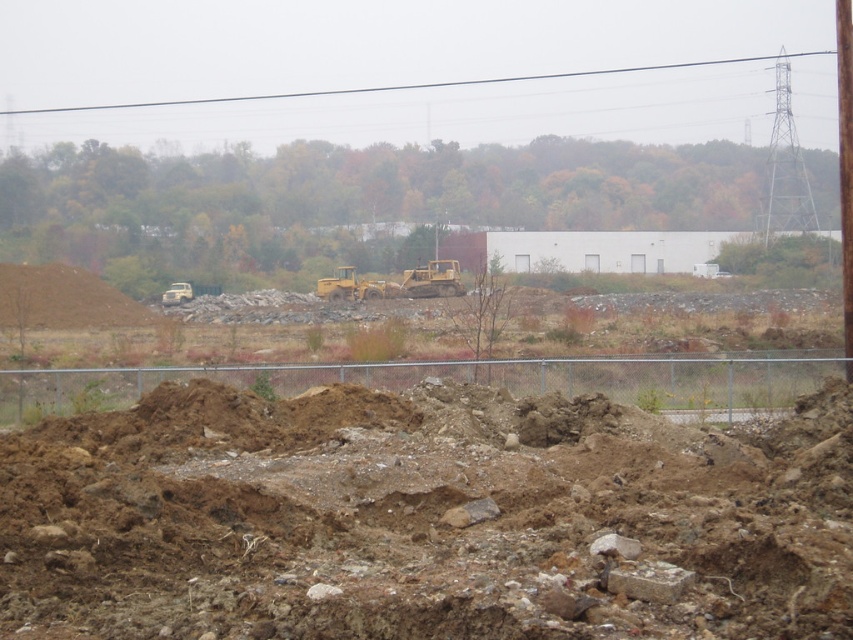
You are an inspector checking safety protocols at the construction site. You notice the black wire at upper center and the yellow metallic excavator at center. Which object is larger in size according to the description?

The black wire at upper center is bigger than the yellow metallic excavator at center according to the description.

You are a construction worker who needs to safely cross the construction site. You see a black wire at upper center and a yellow metallic excavator at center. Which object is farther from your current position?

The black wire at upper center is 81.23 meters away from the yellow metallic excavator at center, so the black wire at upper center is farther from your current position than the yellow metallic excavator at center.

You are a construction worker who needs to locate the black wire at upper center. According to the coordinates given, where exactly should you look on the image?

The black wire at upper center is located at point coordinates of (410, 84).